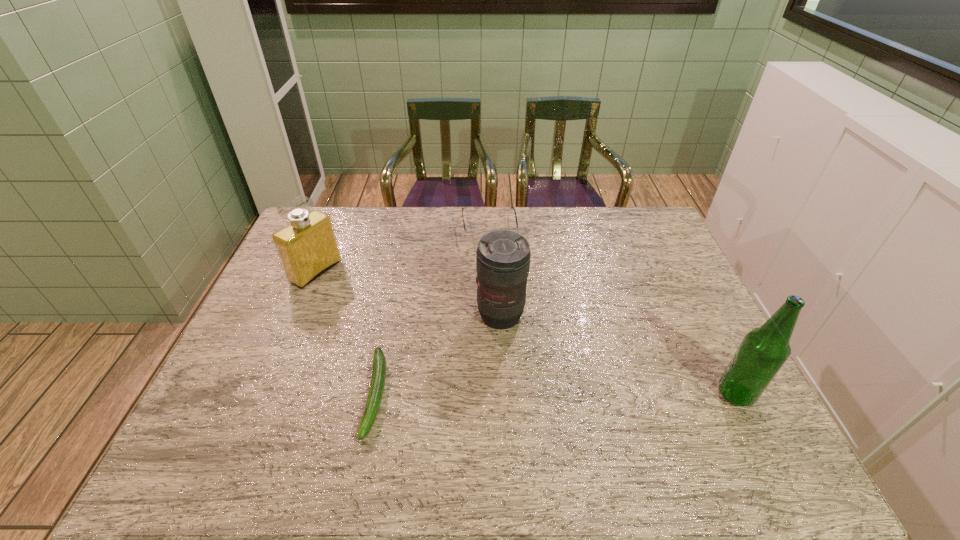
Where is `vacant area at the far right corner`? This screenshot has width=960, height=540. vacant area at the far right corner is located at coordinates (x=622, y=221).

Locate an element on the screen. Image resolution: width=960 pixels, height=540 pixels. free area in between the tallest object and the telephoto lens is located at coordinates (618, 355).

The image size is (960, 540). What are the coordinates of `blank region between the second shortest object and the tallest object` in the screenshot? It's located at (612, 311).

I want to click on free space that is in between the beer bottle and the fourth nearest object, so click(526, 333).

Where is `vacant point located between the rightmost object and the third nearest object`? This screenshot has height=540, width=960. vacant point located between the rightmost object and the third nearest object is located at coordinates (618, 355).

Find the location of a particular element. The width and height of the screenshot is (960, 540). unoccupied position between the farthest object and the tallest object is located at coordinates (612, 311).

At what (x,y) coordinates should I click in order to perform the action: click on free space that is in between the second shortest object and the fourth object from right to left. Please return your answer as a coordinate pair (x, y). Image resolution: width=960 pixels, height=540 pixels. Looking at the image, I should click on (432, 311).

Locate an element on the screen. vacant space in between the third nearest object and the shortest object is located at coordinates (438, 355).

This screenshot has height=540, width=960. In order to click on empty space between the shortest object and the second farthest object in this screenshot , I will do click(346, 333).

This screenshot has height=540, width=960. I want to click on free space between the shortest object and the telephoto lens, so click(x=438, y=355).